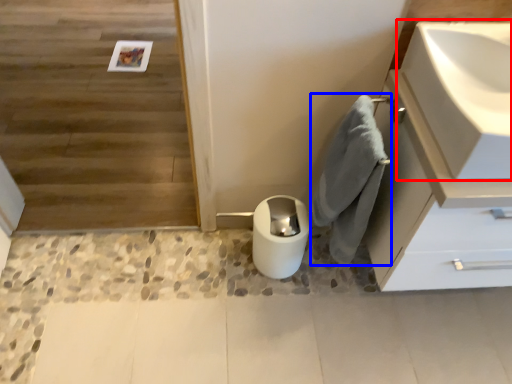
Question: Among these objects, which one is nearest to the camera, sink (highlighted by a red box) or bath towel (highlighted by a blue box)?

Choices:
 (A) sink
 (B) bath towel

Answer: (A)